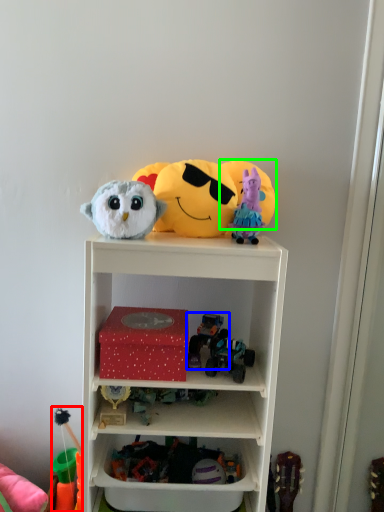
Question: Which object is positioned closest to toy (highlighted by a red box)? Select from toy (highlighted by a blue box) and toy (highlighted by a green box).

Choices:
 (A) toy
 (B) toy

Answer: (A)